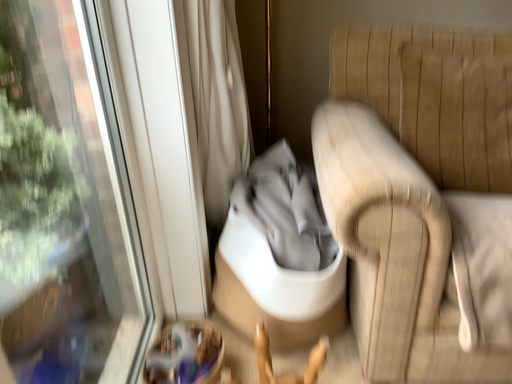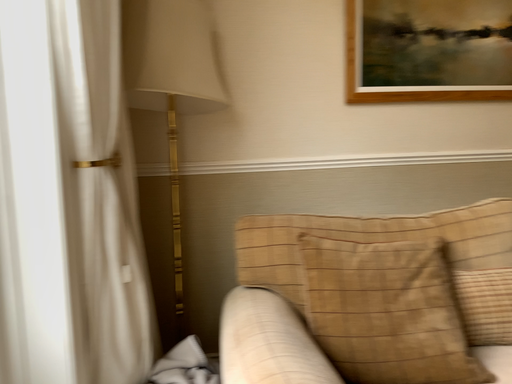
Question: How did the camera likely rotate when shooting the video?

Choices:
 (A) rotated downward
 (B) rotated upward

Answer: (B)